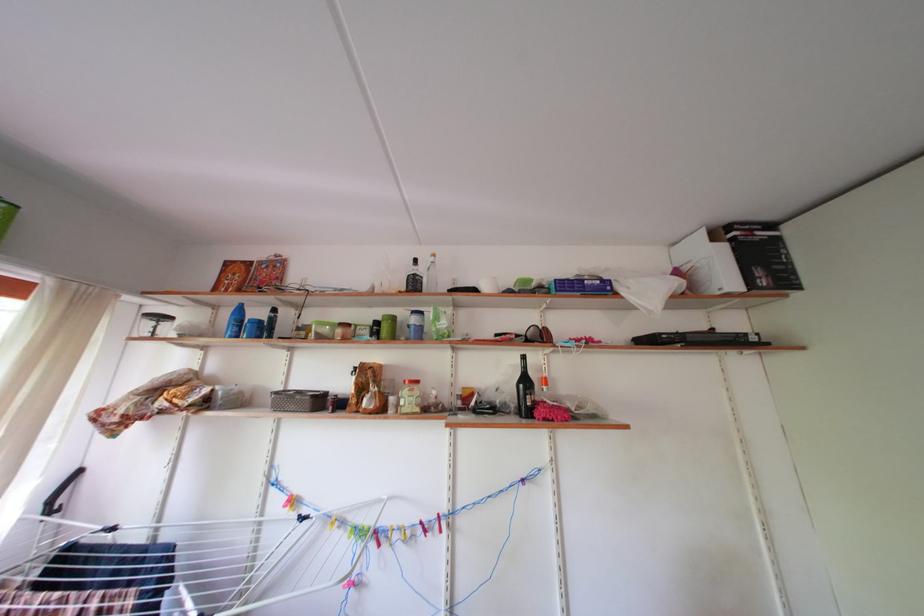
Locate an element on the screen. clear glass bottle is located at coordinates (431, 275).